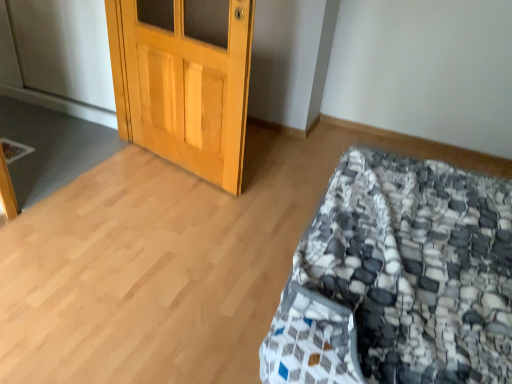
Question: From a real-world perspective, is wooden door at upper left beneath textured gray and white quilt at lower right?

Choices:
 (A) no
 (B) yes

Answer: (A)

Question: Can you confirm if wooden door at upper left is thinner than textured gray and white quilt at lower right?

Choices:
 (A) no
 (B) yes

Answer: (B)

Question: From the image's perspective, would you say wooden door at upper left is positioned over textured gray and white quilt at lower right?

Choices:
 (A) yes
 (B) no

Answer: (A)

Question: Is wooden door at upper left oriented towards textured gray and white quilt at lower right?

Choices:
 (A) yes
 (B) no

Answer: (B)

Question: Is wooden door at upper left smaller than textured gray and white quilt at lower right?

Choices:
 (A) yes
 (B) no

Answer: (A)

Question: Is wooden door at upper left wider than textured gray and white quilt at lower right?

Choices:
 (A) no
 (B) yes

Answer: (A)

Question: From the image's perspective, is textured gray and white quilt at lower right beneath wooden door at upper left?

Choices:
 (A) yes
 (B) no

Answer: (A)

Question: From a real-world perspective, is textured gray and white quilt at lower right located higher than wooden door at upper left?

Choices:
 (A) yes
 (B) no

Answer: (B)

Question: Would you say textured gray and white quilt at lower right is a long distance from wooden door at upper left?

Choices:
 (A) yes
 (B) no

Answer: (A)

Question: Does textured gray and white quilt at lower right appear on the right side of wooden door at upper left?

Choices:
 (A) yes
 (B) no

Answer: (A)

Question: Is textured gray and white quilt at lower right thinner than wooden door at upper left?

Choices:
 (A) no
 (B) yes

Answer: (A)

Question: Does textured gray and white quilt at lower right have a greater width compared to wooden door at upper left?

Choices:
 (A) no
 (B) yes

Answer: (B)

Question: Considering their positions, is textured gray and white quilt at lower right located in front of or behind wooden door at upper left?

Choices:
 (A) behind
 (B) front

Answer: (B)